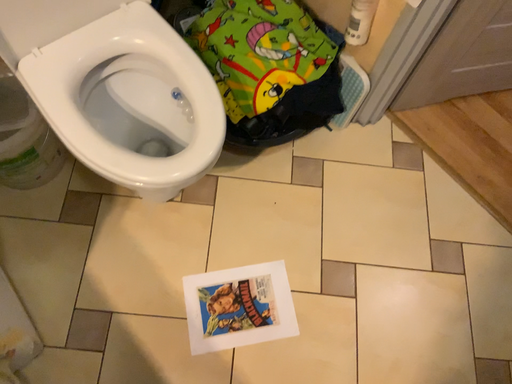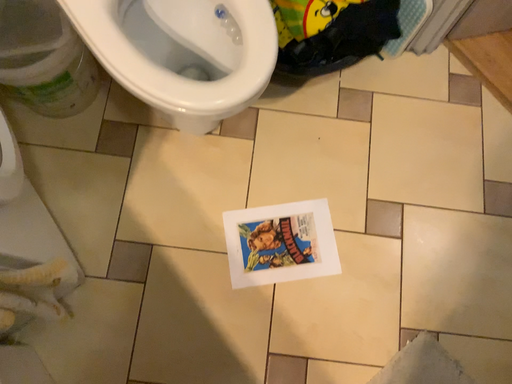
Question: How did the camera likely rotate when shooting the video?

Choices:
 (A) rotated upward
 (B) rotated downward

Answer: (B)